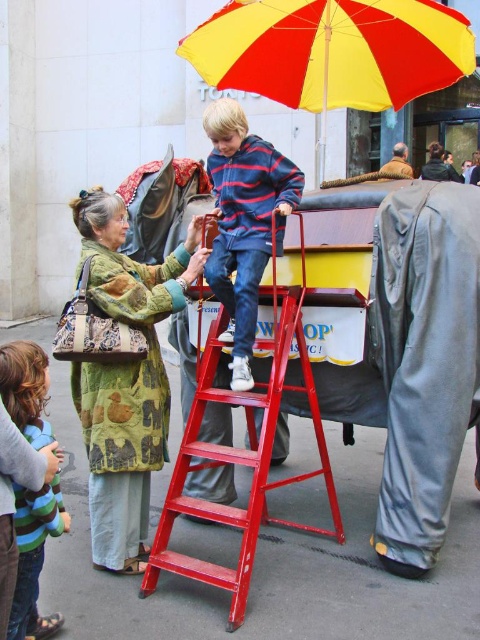
Can you confirm if yellow fabric umbrella at upper center is smaller than striped cotton shirt at lower left?

No.

Looking at this image, is yellow fabric umbrella at upper center to the right of striped cotton shirt at lower left from the viewer's perspective?

Yes, yellow fabric umbrella at upper center is to the right of striped cotton shirt at lower left.

This screenshot has height=640, width=480. Describe the element at coordinates (333, 51) in the screenshot. I see `yellow fabric umbrella at upper center` at that location.

The height and width of the screenshot is (640, 480). I want to click on yellow fabric umbrella at upper center, so click(333, 51).

Is yellow fabric umbrella at upper center wider than striped cotton shirt at center?

Correct, the width of yellow fabric umbrella at upper center exceeds that of striped cotton shirt at center.

Does point (421, 81) come closer to viewer compared to point (216, 285)?

No.

At what (x,y) coordinates should I click in order to perform the action: click on yellow fabric umbrella at upper center. Please return your answer as a coordinate pair (x, y). Looking at the image, I should click on (333, 51).

The height and width of the screenshot is (640, 480). What do you see at coordinates (35, 557) in the screenshot? I see `striped cotton shirt at lower left` at bounding box center [35, 557].

Which is below, striped cotton shirt at lower left or brown leather jacket at upper right?

Positioned lower is striped cotton shirt at lower left.

Does point (33, 372) come behind point (392, 172)?

No, (33, 372) is in front of (392, 172).

Where is `striped cotton shirt at lower left`? The image size is (480, 640). striped cotton shirt at lower left is located at coordinates 35,557.